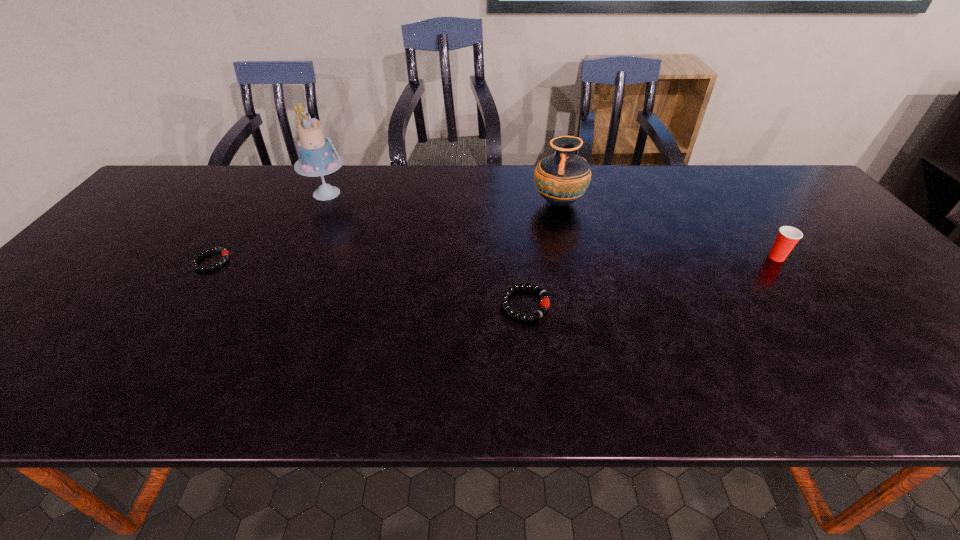
The height and width of the screenshot is (540, 960). I want to click on the fourth object from right to left, so click(x=317, y=158).

Where is `the tallest object`? This screenshot has height=540, width=960. the tallest object is located at coordinates (317, 158).

Identify the location of the fourth shortest object. This screenshot has width=960, height=540. (561, 179).

In order to click on the rightmost object in this screenshot , I will do `click(787, 237)`.

Find the location of a particular element. Image resolution: width=960 pixels, height=540 pixels. the third tallest object is located at coordinates (787, 237).

This screenshot has width=960, height=540. Find the location of `the second shortest object`. the second shortest object is located at coordinates (545, 302).

You are a GUI agent. You are given a task and a screenshot of the screen. Output one action in this format:
    pyautogui.click(x=<x>, y=<y>)
    Task: Click on the nearer bracelet
    The image size is (960, 540).
    Given the screenshot: What is the action you would take?
    [x=545, y=302]

In order to click on the shortest object in this screenshot , I will do `click(225, 253)`.

The width and height of the screenshot is (960, 540). Identify the location of the shorter bracelet. (225, 253).

In order to click on free region located 0.360m with a ladder on the side of the cake in this screenshot , I will do `click(467, 193)`.